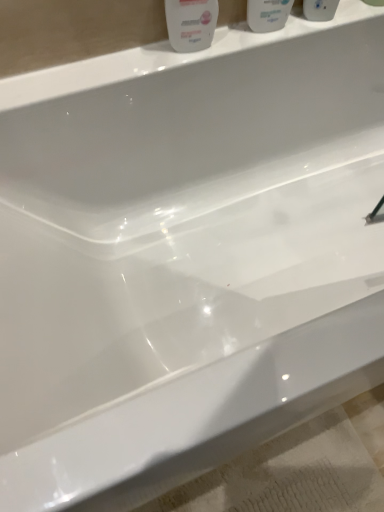
Question: Is white glossy mouthwash at upper center, marked as the second mouthwash in a right-to-left arrangement, far away from white glossy mouthwash at upper center, positioned as the 2th mouthwash in left-to-right order?

Choices:
 (A) no
 (B) yes

Answer: (A)

Question: Can you confirm if white glossy mouthwash at upper center, marked as the second mouthwash in a right-to-left arrangement, is taller than white glossy mouthwash at upper center, positioned as the 2th mouthwash in left-to-right order?

Choices:
 (A) yes
 (B) no

Answer: (B)

Question: From the image's perspective, would you say white glossy mouthwash at upper center, the 1th mouthwash in the left-to-right sequence, is shown under white glossy mouthwash at upper center, positioned as the 2th mouthwash in left-to-right order?

Choices:
 (A) no
 (B) yes

Answer: (B)

Question: Can white glossy mouthwash at upper center, which is counted as the 1th mouthwash, starting from the right, be found inside white glossy mouthwash at upper center, marked as the second mouthwash in a right-to-left arrangement?

Choices:
 (A) no
 (B) yes

Answer: (A)

Question: Is white glossy mouthwash at upper center, marked as the second mouthwash in a right-to-left arrangement, oriented towards white glossy mouthwash at upper center, which is counted as the 1th mouthwash, starting from the right?

Choices:
 (A) no
 (B) yes

Answer: (A)

Question: Is white glossy mouthwash at upper center, the 1th mouthwash in the left-to-right sequence, at the right side of white glossy mouthwash at upper center, which is counted as the 1th mouthwash, starting from the right?

Choices:
 (A) yes
 (B) no

Answer: (B)

Question: Is there a large distance between white glossy mouthwash at upper center, positioned as the 2th mouthwash in left-to-right order, and white glossy bottle at upper center?

Choices:
 (A) yes
 (B) no

Answer: (B)

Question: Does white glossy mouthwash at upper center, which is counted as the 1th mouthwash, starting from the right, come in front of white glossy bottle at upper center?

Choices:
 (A) yes
 (B) no

Answer: (B)

Question: Is white glossy mouthwash at upper center, which is counted as the 1th mouthwash, starting from the right, positioned beyond the bounds of white glossy bottle at upper center?

Choices:
 (A) no
 (B) yes

Answer: (B)

Question: From a real-world perspective, is white glossy mouthwash at upper center, positioned as the 2th mouthwash in left-to-right order, under white glossy bottle at upper center?

Choices:
 (A) no
 (B) yes

Answer: (A)

Question: Can you confirm if white glossy mouthwash at upper center, which is counted as the 1th mouthwash, starting from the right, is taller than white glossy bottle at upper center?

Choices:
 (A) no
 (B) yes

Answer: (B)

Question: Can you confirm if white glossy mouthwash at upper center, positioned as the 2th mouthwash in left-to-right order, is wider than white glossy bottle at upper center?

Choices:
 (A) no
 (B) yes

Answer: (A)

Question: Is white glossy bottle at upper center wider than white glossy mouthwash at upper center, positioned as the 2th mouthwash in left-to-right order?

Choices:
 (A) yes
 (B) no

Answer: (A)